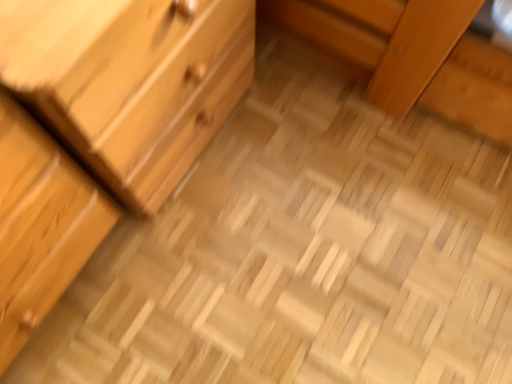
What are the coordinates of `matte wood chest of drawers at left` in the screenshot? It's located at (132, 82).

This screenshot has width=512, height=384. What do you see at coordinates (132, 82) in the screenshot?
I see `matte wood chest of drawers at left` at bounding box center [132, 82].

What is the approximate height of matte wood chest of drawers at left?

It is 23.12 inches.

Measure the distance between point (226, 104) and camera.

The distance of point (226, 104) from camera is 3.39 feet.

Find the location of a particular element. matte wood chest of drawers at left is located at coordinates (132, 82).